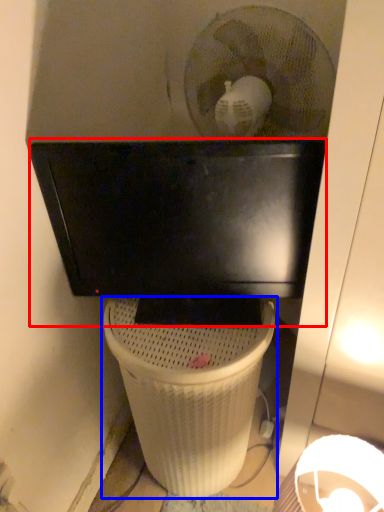
Question: Which object appears farthest to the camera in this image, computer monitor (highlighted by a red box) or waste container (highlighted by a blue box)?

Choices:
 (A) computer monitor
 (B) waste container

Answer: (B)